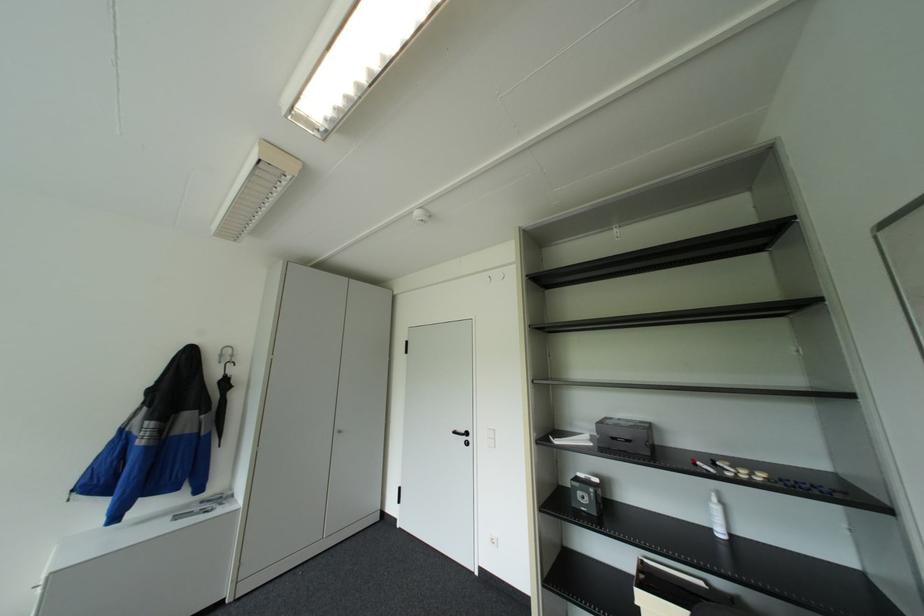
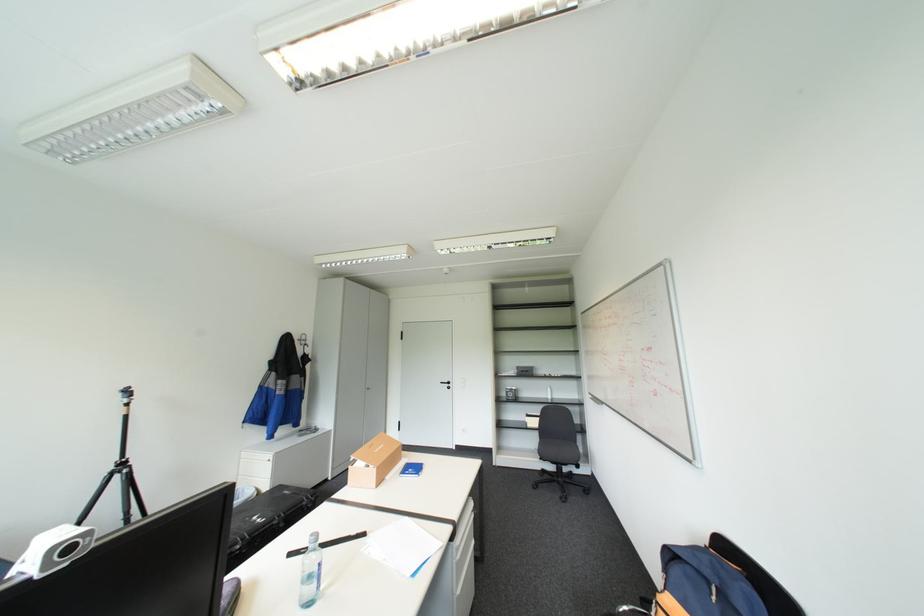
Locate, in the second image, the point that corresponds to point 463,431 in the first image.

(450, 381)